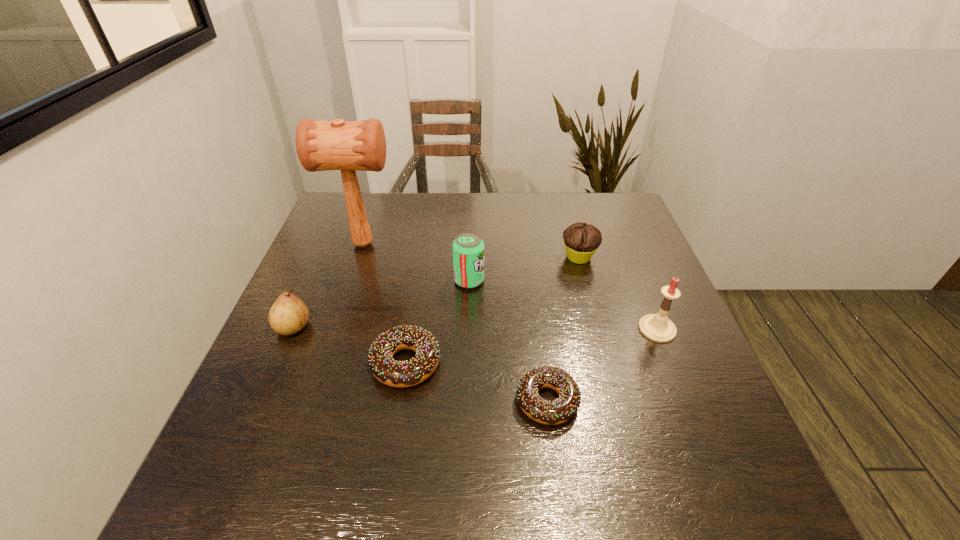
Identify the location of mallet that is at the left edge. (321, 145).

You are a GUI agent. You are given a task and a screenshot of the screen. Output one action in this format:
    pyautogui.click(x=<x>, y=<y>)
    Task: Click on the pear that is at the left edge
    The image size is (960, 540).
    Given the screenshot: What is the action you would take?
    point(289,314)

Image resolution: width=960 pixels, height=540 pixels. What are the coordinates of `candle present at the right edge` in the screenshot? It's located at (657, 327).

The height and width of the screenshot is (540, 960). Identify the location of muffin present at the right edge. (581, 241).

I want to click on object located in the far left corner section of the desktop, so 321,145.

The image size is (960, 540). I want to click on vacant space at the far edge of the desktop, so click(x=457, y=224).

Identify the location of blank space at the near edge of the desktop. The image size is (960, 540). (499, 431).

Locate an element on the screen. This screenshot has width=960, height=540. free space at the left edge of the desktop is located at coordinates (337, 244).

Where is `free space at the right edge of the desktop`? This screenshot has height=540, width=960. free space at the right edge of the desktop is located at coordinates (652, 282).

This screenshot has width=960, height=540. I want to click on unoccupied position between the pear and the mallet, so pyautogui.click(x=328, y=286).